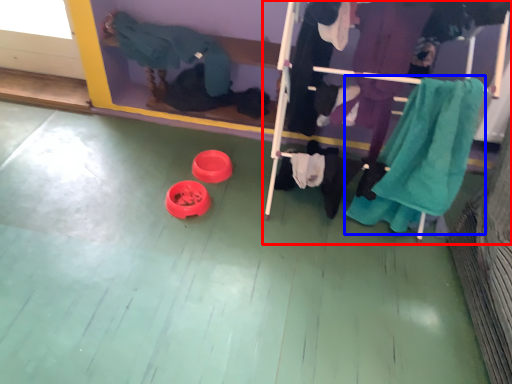
Question: Among these objects, which one is farthest to the camera, furniture (highlighted by a red box) or clothing (highlighted by a blue box)?

Choices:
 (A) furniture
 (B) clothing

Answer: (B)